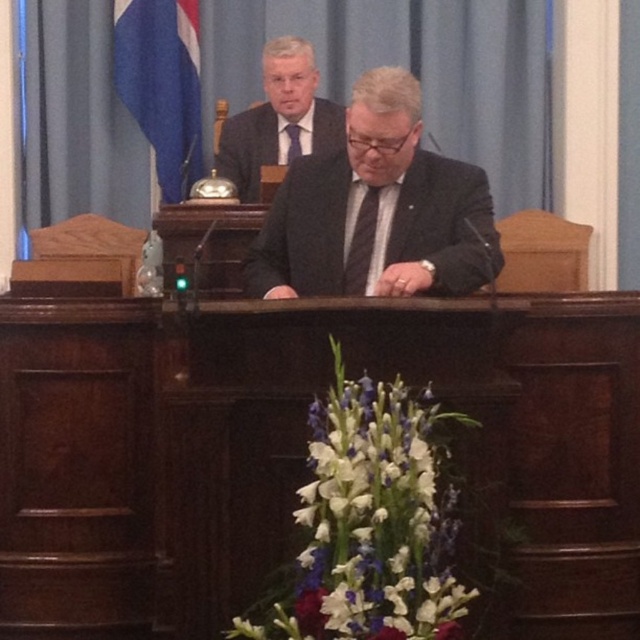
Looking at this image, you are standing at the point marked as point [189,104] in the assembly room. You need to exit the room quickly. The nearest door is located at the opposite end of the room. Considering your current position, can you reach the door within 5 seconds if you walk at a normal pace?

The distance between point [189,104] and the viewer is 4.63 meters. Walking at a normal pace of about 1.4 meters per second, it would take approximately 3.3 seconds to cover this distance. Since the door is at the opposite end, you can reach it within 5 seconds.

You are attending a formal event and need to determine the correct order of items from top to bottom. Which item is positioned higher in the image, the matte black suit at center or the purple silk tie at center?

The purple silk tie at center is positioned higher than the matte black suit at center in the image.